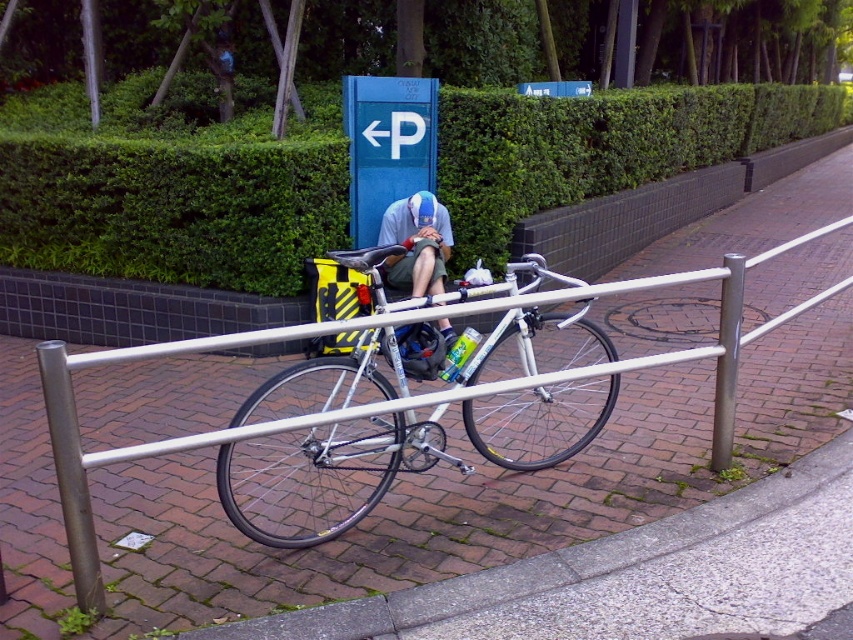
Question: Which of the following is the farthest from the observer?

Choices:
 (A) green leafy hedge at upper center
 (B) white metallic bicycle at center

Answer: (A)

Question: Among these points, which one is farthest from the camera?

Choices:
 (A) (416, 243)
 (B) (448, 136)

Answer: (B)

Question: Based on their relative distances, which object is farther from the white metallic bicycle at center?

Choices:
 (A) green leafy hedge at upper center
 (B) light blue fabric cap at center

Answer: (A)

Question: Does white metallic bicycle at center appear over light blue fabric cap at center?

Choices:
 (A) yes
 (B) no

Answer: (B)

Question: Is white metallic bicycle at center bigger than light blue fabric cap at center?

Choices:
 (A) no
 (B) yes

Answer: (B)

Question: Does green leafy hedge at upper center have a larger size compared to light blue fabric cap at center?

Choices:
 (A) no
 (B) yes

Answer: (B)